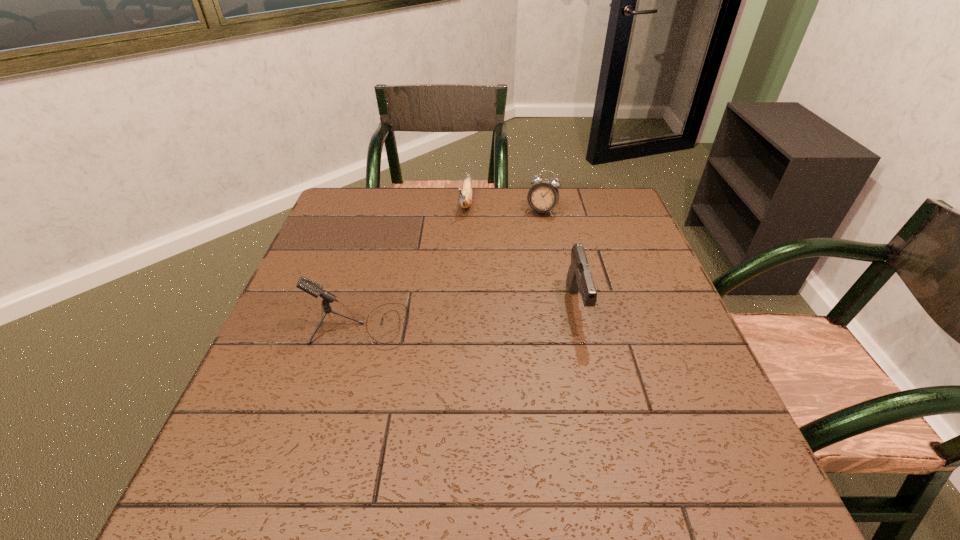
You are a GUI agent. You are given a task and a screenshot of the screen. Output one action in this format:
    pyautogui.click(x=<x>, y=<y>)
    Task: Click on the microphone
    Image resolution: width=960 pixels, height=540 pixels.
    Given the screenshot: What is the action you would take?
    pyautogui.click(x=314, y=289)

Identify the location of pistol. (579, 278).

Identify the location of alarm clock. This screenshot has height=540, width=960. (542, 197).

Where is `banana`? banana is located at coordinates (465, 200).

Identify the location of the second object from left to right. The height and width of the screenshot is (540, 960). (465, 200).

At what (x,y) coordinates should I click in order to perform the action: click on vacant region located 0.070m on the stand of the microphone. Please return your answer as a coordinate pair (x, y). This screenshot has width=960, height=540. Looking at the image, I should click on (439, 326).

The height and width of the screenshot is (540, 960). In order to click on free space located aim along the barrel of the pistol in this screenshot , I will do `click(601, 408)`.

I want to click on vacant point located on the face of the alarm clock, so click(x=529, y=237).

Locate an element on the screen. The image size is (960, 540). free region located on the face of the alarm clock is located at coordinates (499, 302).

You are a GUI agent. You are given a task and a screenshot of the screen. Output one action in this format:
    pyautogui.click(x=<x>, y=<y>)
    Task: Click on the vacant region located on the face of the alarm clock
    The width and height of the screenshot is (960, 540).
    Given the screenshot: What is the action you would take?
    pyautogui.click(x=525, y=247)